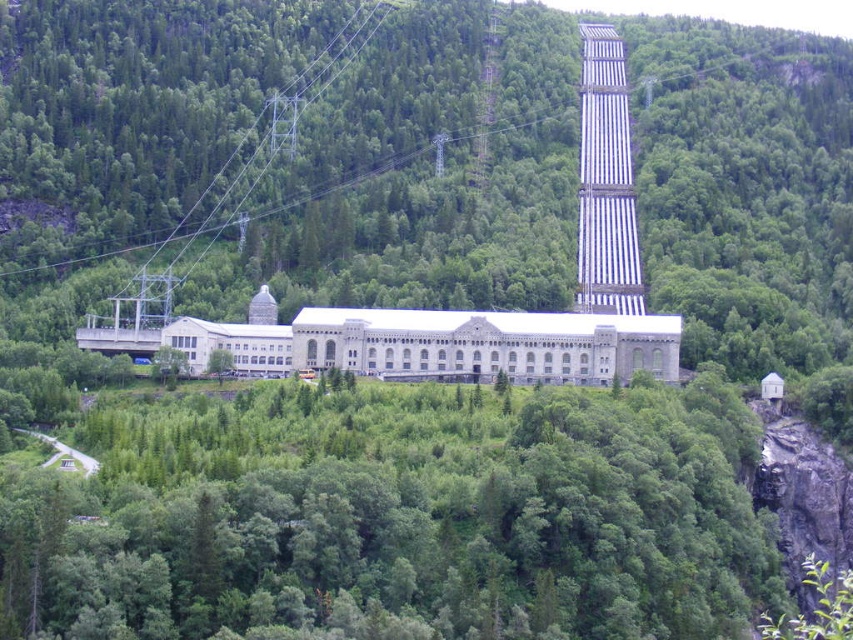
You are a drone operator planning to fly a drone between the metallic grid tower at center and the green leafy tree at center. Based on their widths, which object should you avoid flying too close to?

The metallic grid tower at center has a larger width than the green leafy tree at center, so you should avoid flying too close to the metallic grid tower at center due to its greater width.

You are a bird looking for a nesting spot. You see two options in the image, the green leafy trees at center and the green leafy tree at center. Which one is taller?

The green leafy trees at center has a greater height compared to the green leafy tree at center, so the green leafy trees at center is taller.

You are standing at the edge of the forest looking towards the hydroelectric power station. You see a metallic grid tower at center and a green leafy tree at center. Which object is positioned to the right of the other?

The metallic grid tower at center is to the right of the green leafy tree at center.